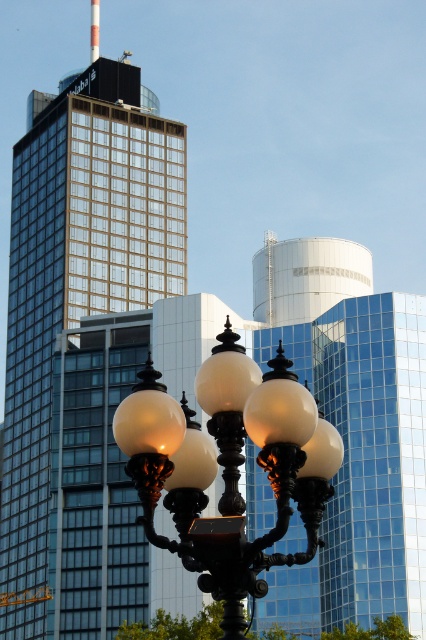
Question: Is matte glass skyscraper at center wider than matte black street light at center?

Choices:
 (A) yes
 (B) no

Answer: (A)

Question: Is matte glass skyscraper at center wider than matte black street light at center?

Choices:
 (A) yes
 (B) no

Answer: (A)

Question: Which point appears closest to the camera in this image?

Choices:
 (A) (80, 577)
 (B) (212, 548)

Answer: (B)

Question: Does matte glass skyscraper at center appear under matte black street light at center?

Choices:
 (A) no
 (B) yes

Answer: (B)